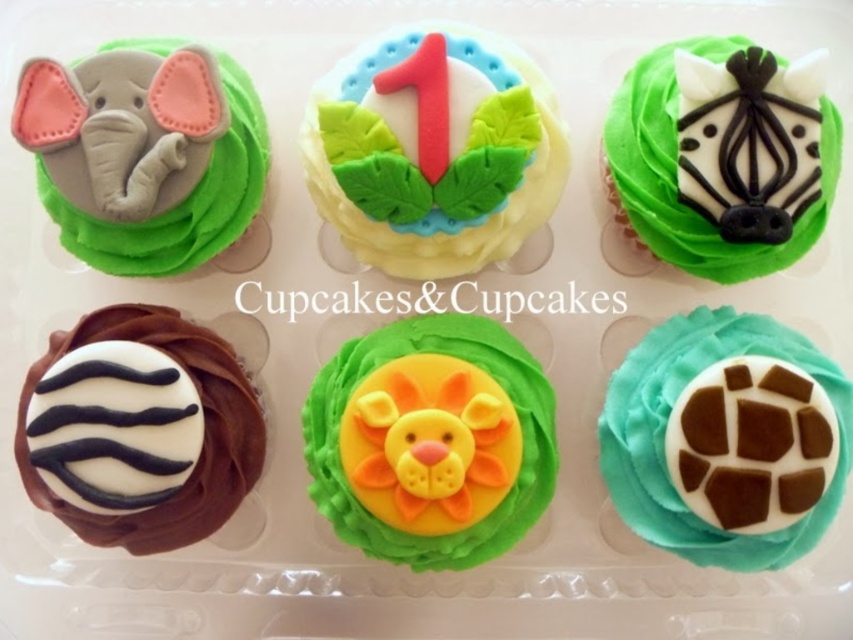
Does yellow fondant cake with leaf decorations at center have a greater height compared to white matte zebra print cupcake at bottom left?

Indeed, yellow fondant cake with leaf decorations at center has a greater height compared to white matte zebra print cupcake at bottom left.

Does yellow fondant cake with leaf decorations at center have a smaller size compared to white matte zebra print cupcake at bottom left?

No.

Does point (442, 170) come in front of point (144, 340)?

Yes, it is.

I want to click on yellow fondant cake with leaf decorations at center, so click(434, 152).

Can you confirm if yellow fondant lion at center is positioned above matte gray elephant at upper left?

Incorrect, yellow fondant lion at center is not positioned above matte gray elephant at upper left.

Which is in front, point (509, 536) or point (229, 90)?

Point (509, 536) is in front.

Describe the element at coordinates (431, 442) in the screenshot. This screenshot has width=853, height=640. I see `yellow fondant lion at center` at that location.

Locate an element on the screen. yellow fondant lion at center is located at coordinates (431, 442).

Which is more to the right, matte gray elephant at upper left or white matte zebra print cupcake at bottom left?

matte gray elephant at upper left

Which of these two, matte gray elephant at upper left or white matte zebra print cupcake at bottom left, stands shorter?

With less height is matte gray elephant at upper left.

What do you see at coordinates (144, 152) in the screenshot? I see `matte gray elephant at upper left` at bounding box center [144, 152].

Where is `matte gray elephant at upper left`? Image resolution: width=853 pixels, height=640 pixels. matte gray elephant at upper left is located at coordinates click(x=144, y=152).